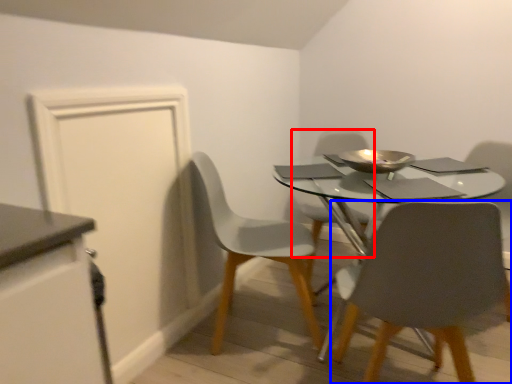
Question: Which of the following is the farthest to the observer, chair (highlighted by a red box) or chair (highlighted by a blue box)?

Choices:
 (A) chair
 (B) chair

Answer: (A)